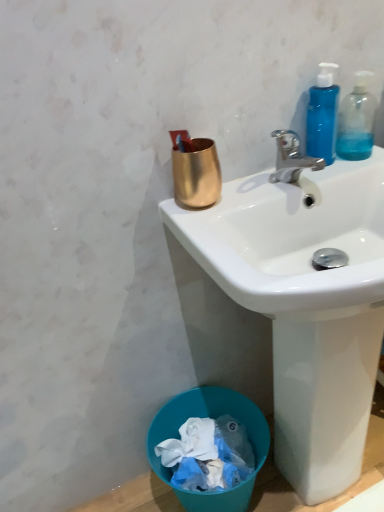
Locate an element on the screen. The image size is (384, 512). empty space that is in between gold metallic cup at upper center and polished chrome faucet at upper right is located at coordinates (247, 192).